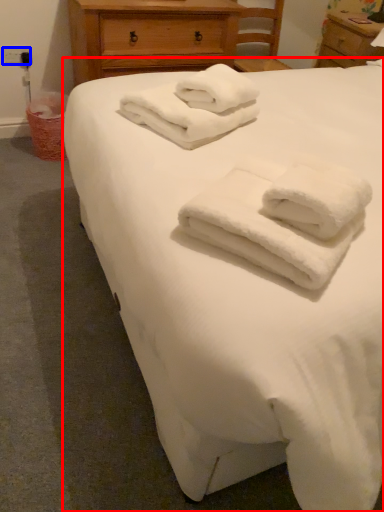
Question: Which of the following is the closest to the observer, bed (highlighted by a red box) or electric outlet (highlighted by a blue box)?

Choices:
 (A) bed
 (B) electric outlet

Answer: (A)